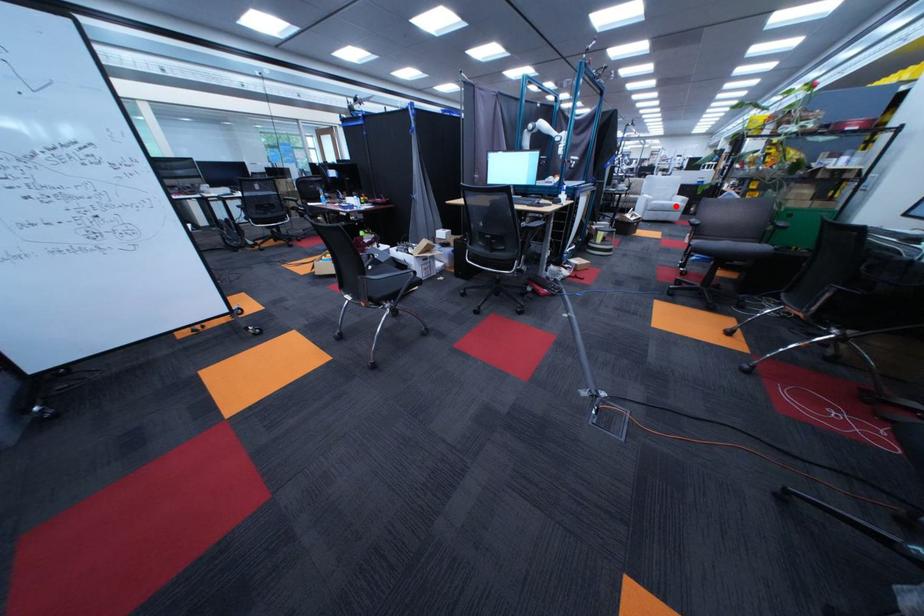
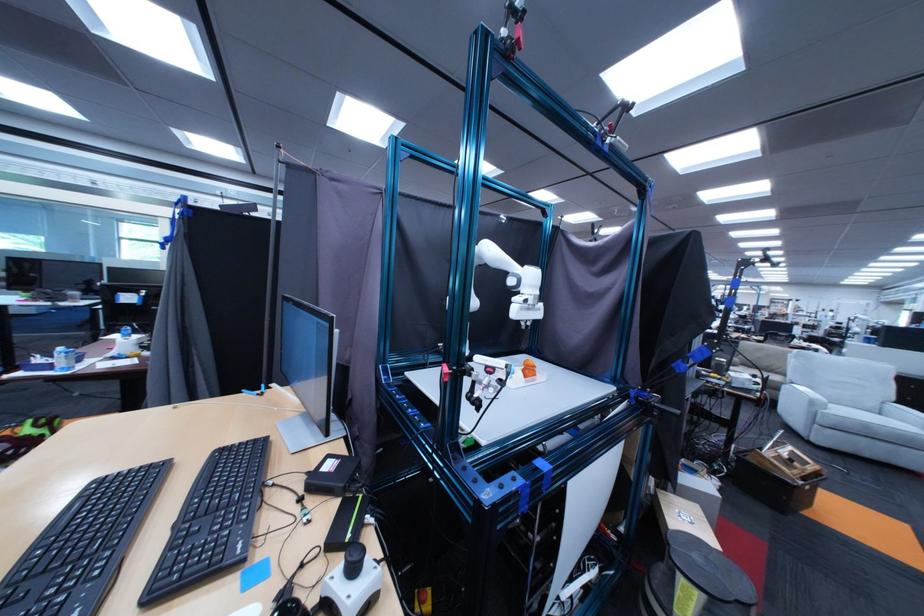
Where in the second image is the point corresponding to the highlighted location from the first image?

(879, 426)